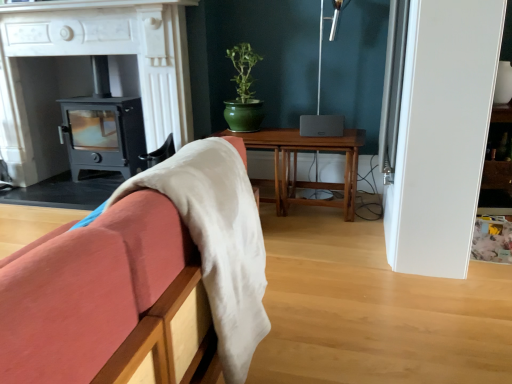
Question: From a real-world perspective, does white marble fireplace at center stand above wooden sofa at left?

Choices:
 (A) no
 (B) yes

Answer: (B)

Question: Is white marble fireplace at center to the right of wooden sofa at left from the viewer's perspective?

Choices:
 (A) no
 (B) yes

Answer: (A)

Question: From the image's perspective, would you say white marble fireplace at center is shown under wooden sofa at left?

Choices:
 (A) yes
 (B) no

Answer: (B)

Question: Considering the relative sizes of white marble fireplace at center and wooden sofa at left in the image provided, is white marble fireplace at center taller than wooden sofa at left?

Choices:
 (A) yes
 (B) no

Answer: (A)

Question: Would you say wooden sofa at left is part of white marble fireplace at center's contents?

Choices:
 (A) no
 (B) yes

Answer: (A)

Question: Does white marble fireplace at center have a smaller size compared to wooden sofa at left?

Choices:
 (A) no
 (B) yes

Answer: (A)

Question: From a real-world perspective, is wooden table at center below white marble fireplace at center?

Choices:
 (A) yes
 (B) no

Answer: (A)

Question: Does wooden table at center appear on the left side of white marble fireplace at center?

Choices:
 (A) no
 (B) yes

Answer: (A)

Question: Is wooden table at center facing away from white marble fireplace at center?

Choices:
 (A) no
 (B) yes

Answer: (A)

Question: Could you tell me if wooden table at center is facing white marble fireplace at center?

Choices:
 (A) no
 (B) yes

Answer: (A)

Question: Is white marble fireplace at center completely or partially inside wooden table at center?

Choices:
 (A) no
 (B) yes

Answer: (A)

Question: Is the position of wooden table at center more distant than that of white marble fireplace at center?

Choices:
 (A) yes
 (B) no

Answer: (A)

Question: From a real-world perspective, is matte black wood burning stove at left located beneath wooden table at center?

Choices:
 (A) yes
 (B) no

Answer: (B)